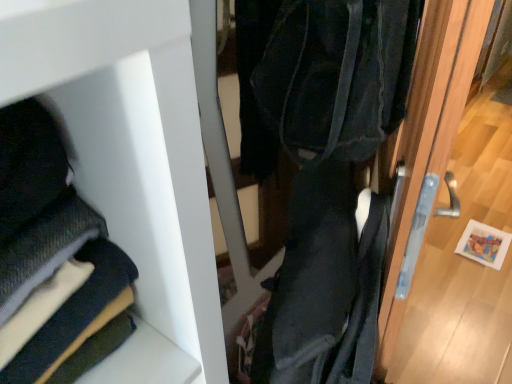
Question: Is wooden door handle at right closer to the viewer compared to dark blue fabric at lower left?

Choices:
 (A) no
 (B) yes

Answer: (A)

Question: Can you confirm if wooden door handle at right is positioned to the right of dark blue fabric at lower left?

Choices:
 (A) no
 (B) yes

Answer: (B)

Question: Is the surface of wooden door handle at right in direct contact with dark blue fabric at lower left?

Choices:
 (A) no
 (B) yes

Answer: (A)

Question: Is wooden door handle at right aimed at dark blue fabric at lower left?

Choices:
 (A) no
 (B) yes

Answer: (B)

Question: Is wooden door handle at right turned away from dark blue fabric at lower left?

Choices:
 (A) no
 (B) yes

Answer: (A)

Question: From the image's perspective, would you say wooden door handle at right is shown under dark blue fabric at lower left?

Choices:
 (A) no
 (B) yes

Answer: (B)

Question: From a real-world perspective, is dark blue fabric at lower left physically below wooden door handle at right?

Choices:
 (A) no
 (B) yes

Answer: (A)

Question: Is dark blue fabric at lower left thinner than wooden door handle at right?

Choices:
 (A) no
 (B) yes

Answer: (A)

Question: Is dark blue fabric at lower left far from wooden door handle at right?

Choices:
 (A) yes
 (B) no

Answer: (A)

Question: From the image's perspective, is dark blue fabric at lower left below wooden door handle at right?

Choices:
 (A) yes
 (B) no

Answer: (B)

Question: Does dark blue fabric at lower left have a greater width compared to wooden door handle at right?

Choices:
 (A) yes
 (B) no

Answer: (A)

Question: From the image's perspective, is dark blue fabric at lower left on top of wooden door handle at right?

Choices:
 (A) yes
 (B) no

Answer: (A)

Question: From the image's perspective, is wooden door handle at right above or below dark blue fabric at lower left?

Choices:
 (A) below
 (B) above

Answer: (A)